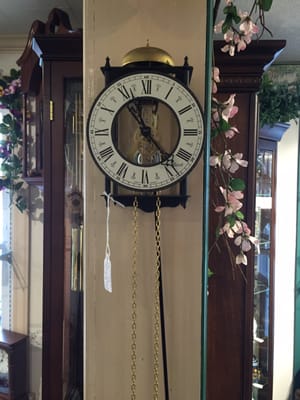
Where is `ceiling`? The width and height of the screenshot is (300, 400). ceiling is located at coordinates (14, 18), (280, 23).